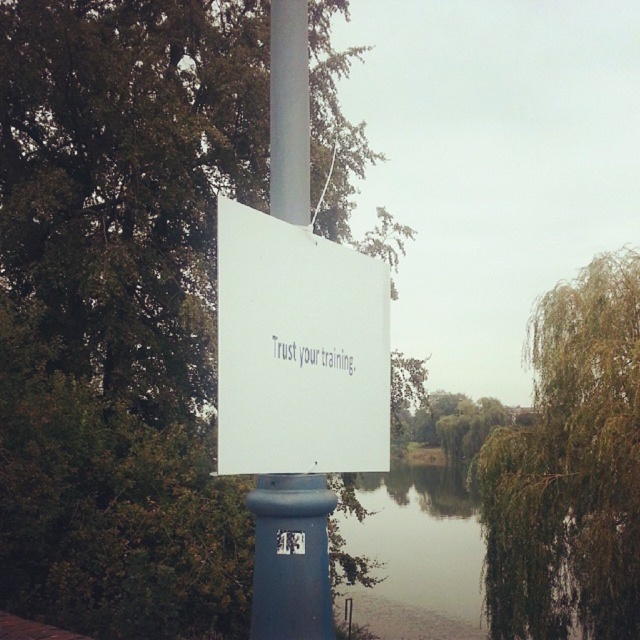
Is green leafy tree at upper left smaller than white plastic sign at center?

No.

Based on the photo, does green leafy tree at upper left appear over white plastic sign at center?

Indeed, green leafy tree at upper left is positioned over white plastic sign at center.

Who is more forward, (397, 403) or (273, 632)?

Positioned in front is point (273, 632).

Image resolution: width=640 pixels, height=640 pixels. What are the coordinates of `green leafy tree at upper left` in the screenshot? It's located at (122, 308).

Describe the element at coordinates (570, 468) in the screenshot. I see `green leafy tree at right` at that location.

Who is taller, green leafy tree at right or white paper sign at center?

green leafy tree at right is taller.

Between point (576, 545) and point (284, 326), which one is positioned behind?

Positioned behind is point (576, 545).

Identify the location of green leafy tree at right. This screenshot has width=640, height=640. (570, 468).

Between green leafy tree at right and white plastic sign at center, which one is positioned higher?

white plastic sign at center

Which is in front, point (540, 609) or point (296, 216)?

Point (296, 216) is in front.

Does point (593, 310) come behind point (291, 144)?

That is True.

I want to click on green leafy tree at right, so click(x=570, y=468).